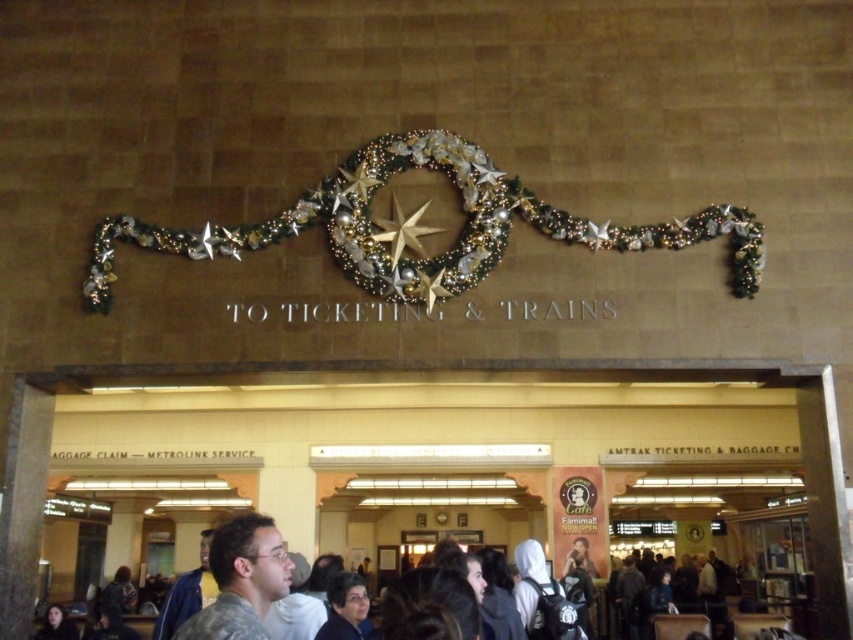
You are a GUI agent. You are given a task and a screenshot of the screen. Output one action in this format:
    pyautogui.click(x=<x>, y=<y>)
    Task: Click on the camouflage fabric shirt at center
    
    Given the screenshot: What is the action you would take?
    pyautogui.click(x=241, y=580)

What do you see at coordinates (241, 580) in the screenshot? This screenshot has width=853, height=640. I see `camouflage fabric shirt at center` at bounding box center [241, 580].

Locate an element on the screen. The height and width of the screenshot is (640, 853). camouflage fabric shirt at center is located at coordinates pyautogui.click(x=241, y=580).

The width and height of the screenshot is (853, 640). I want to click on camouflage jacket at lower center, so click(178, 620).

What do you see at coordinates (178, 620) in the screenshot? This screenshot has width=853, height=640. I see `camouflage jacket at lower center` at bounding box center [178, 620].

Identify the location of camouflage jacket at lower center. (178, 620).

Find the location of a particular element. The image size is (853, 640). camouflage fabric shirt at center is located at coordinates (241, 580).

Which is above, camouflage fabric shirt at center or camouflage jacket at lower center?

camouflage fabric shirt at center is above.

What do you see at coordinates (241, 580) in the screenshot?
I see `camouflage fabric shirt at center` at bounding box center [241, 580].

The height and width of the screenshot is (640, 853). What are the coordinates of `camouflage fabric shirt at center` in the screenshot? It's located at (241, 580).